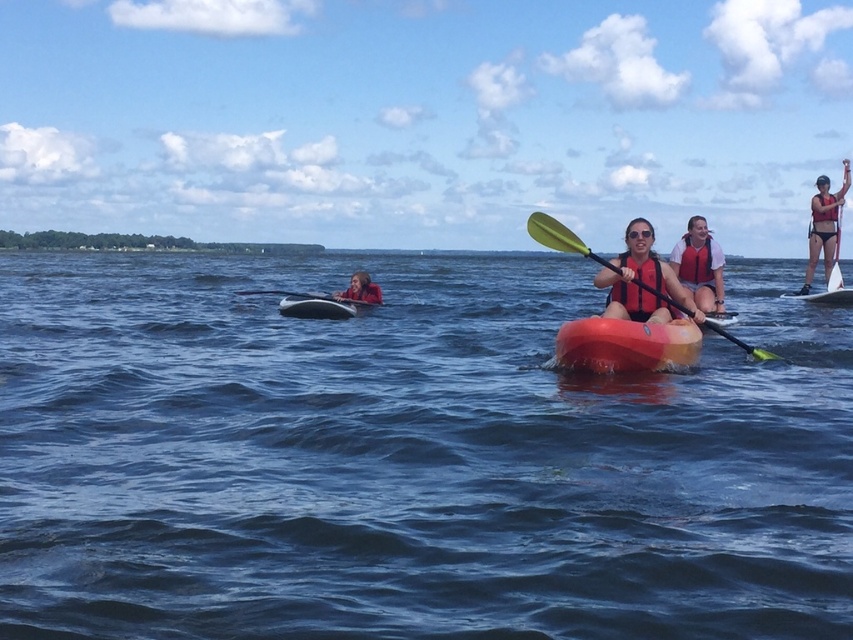
Question: Which point is farther to the camera?

Choices:
 (A) pos(352,301)
 (B) pos(828,195)
 (C) pos(434,266)
 (D) pos(367,292)

Answer: (C)

Question: Can you confirm if blue water at center is wider than matte red kayak at center?

Choices:
 (A) yes
 (B) no

Answer: (A)

Question: Which point is farther from the camera taking this photo?

Choices:
 (A) (820, 188)
 (B) (552, 227)

Answer: (A)

Question: Is white matte life vest at center bigger than white glossy canoe at center?

Choices:
 (A) yes
 (B) no

Answer: (A)

Question: Considering the real-world distances, which object is closest to the orange matte life jacket at center?

Choices:
 (A) red life jacket at center
 (B) yellow matte paddle at center
 (C) matte red life vest at center

Answer: (B)

Question: Does orange matte life jacket at center appear on the left side of white glossy canoe at center?

Choices:
 (A) yes
 (B) no

Answer: (B)